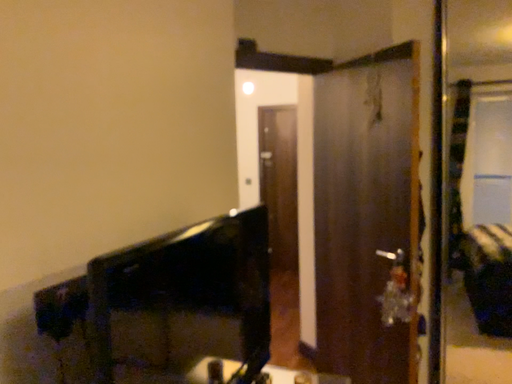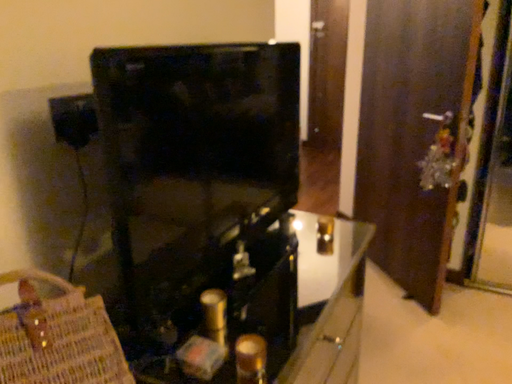
Question: Which way did the camera rotate in the video?

Choices:
 (A) rotated left
 (B) rotated right

Answer: (A)